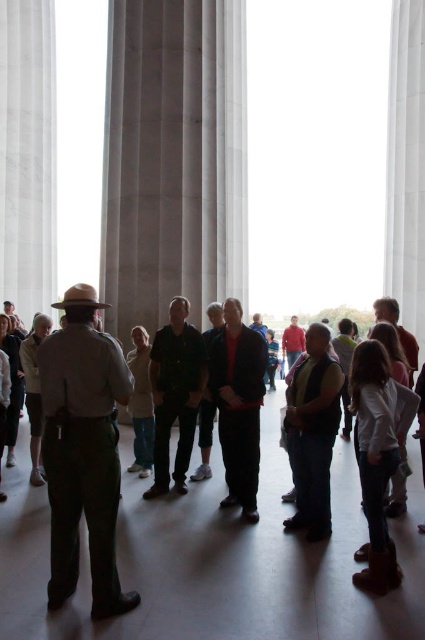
Is white marble pillar at upper center below red fabric jacket at center?

No, white marble pillar at upper center is not below red fabric jacket at center.

Locate an element on the screen. This screenshot has height=640, width=425. white marble pillar at upper center is located at coordinates (405, 164).

Identify the location of white marble pillar at upper center. This screenshot has width=425, height=640. (405, 164).

Does white marble pillar at center lie in front of white marble pillar at upper center?

Yes, white marble pillar at center is closer to the viewer.

Does point (110, 49) come closer to viewer compared to point (407, 316)?

Yes, point (110, 49) is closer to viewer.

Where is `white marble pillar at center`? white marble pillar at center is located at coordinates (173, 157).

Does white marble pillar at center have a smaller size compared to khaki uniform at center?

Actually, white marble pillar at center might be larger than khaki uniform at center.

The height and width of the screenshot is (640, 425). What do you see at coordinates (173, 157) in the screenshot?
I see `white marble pillar at center` at bounding box center [173, 157].

Find the location of a particular element. The image size is (425, 640). white marble pillar at center is located at coordinates (173, 157).